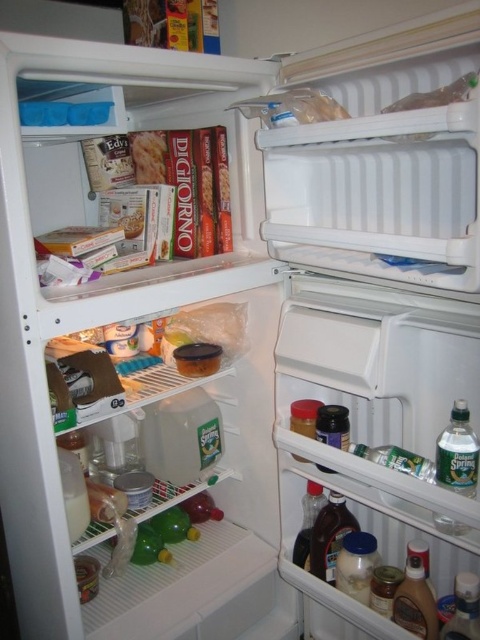
In the scene shown: Does clear plastic water at lower right have a lesser width compared to dark brown glass at lower center?

Yes.

Who is shorter, clear plastic water at lower right or dark brown glass at lower center?

dark brown glass at lower center

What do you see at coordinates (457, 452) in the screenshot?
I see `clear plastic water at lower right` at bounding box center [457, 452].

The height and width of the screenshot is (640, 480). I want to click on clear plastic water at lower right, so click(x=457, y=452).